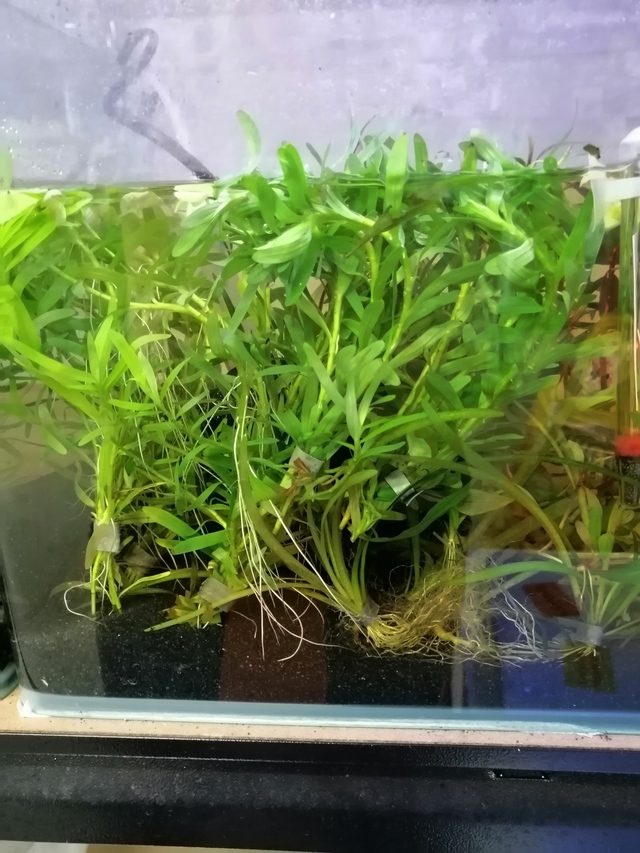
Where is `terrarium`? The height and width of the screenshot is (853, 640). terrarium is located at coordinates (429, 658).